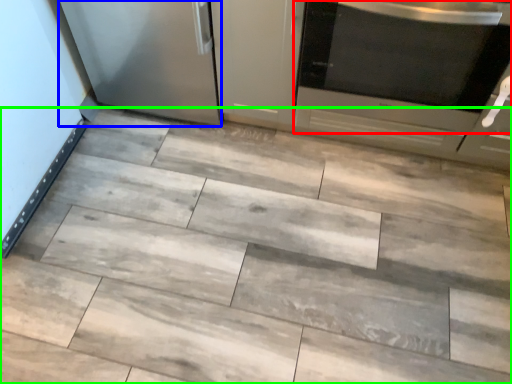
Question: Which is farther away from home appliance (highlighted by a red box)? appliance (highlighted by a blue box) or ceramic tile (highlighted by a green box)?

Choices:
 (A) appliance
 (B) ceramic tile

Answer: (A)